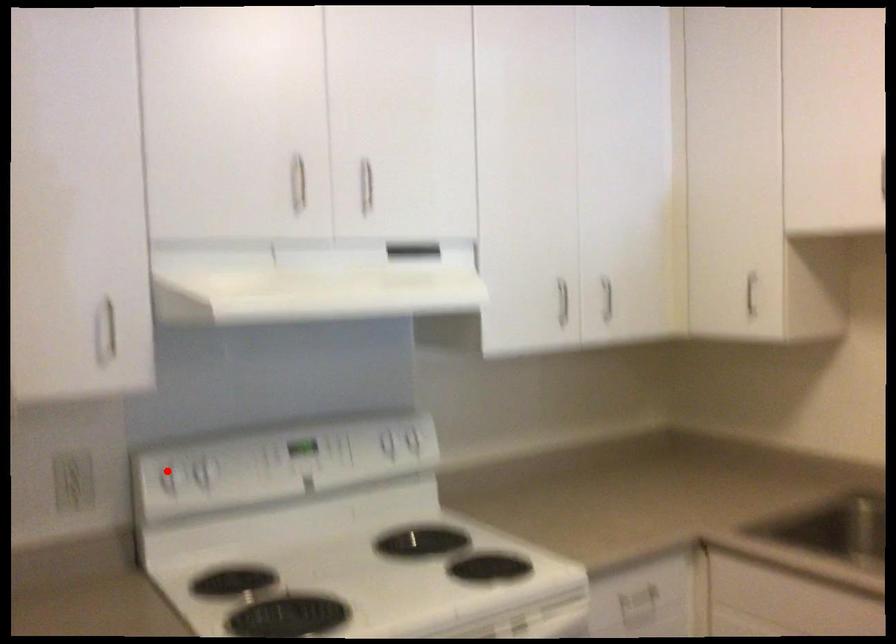
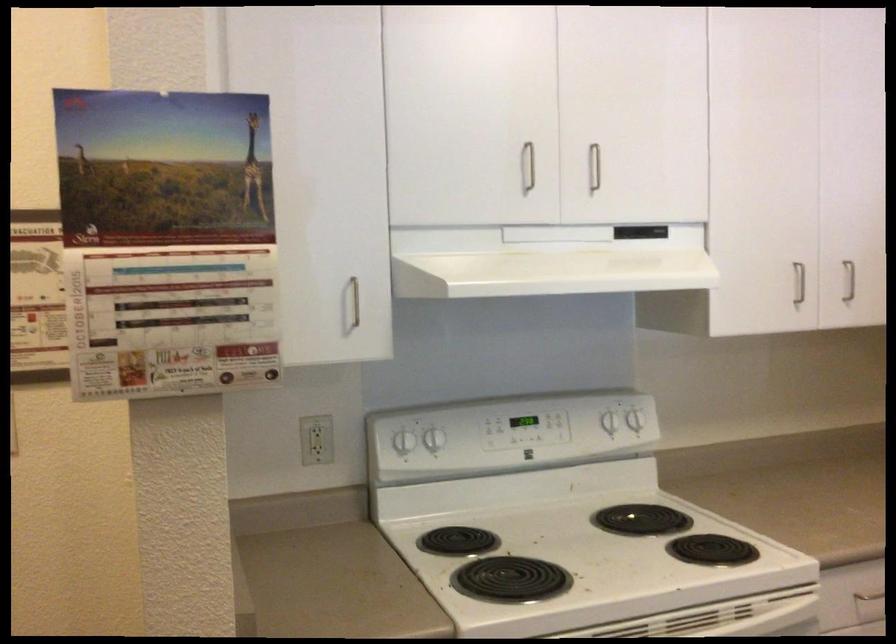
In the second image, find the point that corresponds to the highlighted location in the first image.

(400, 433)